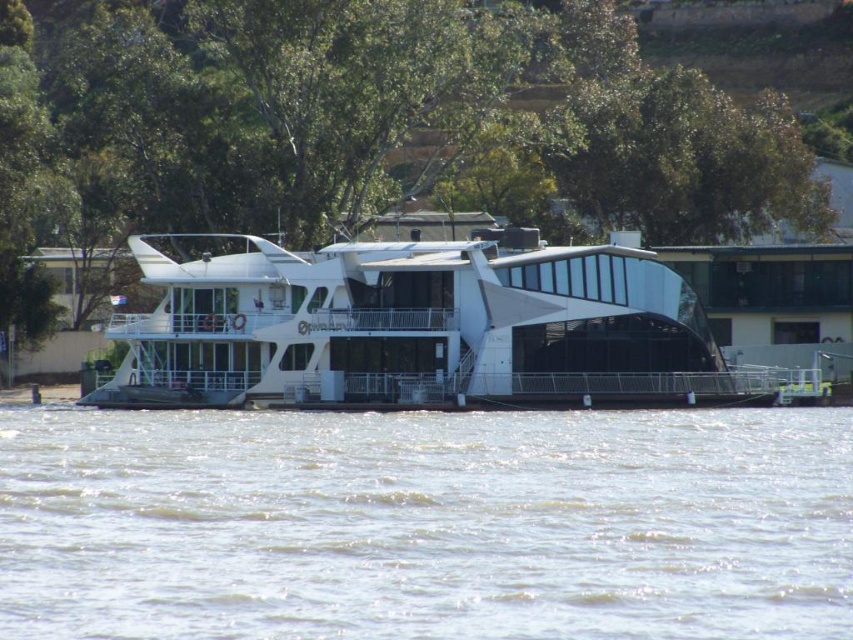
How much distance is there between clear water at lower center and white glossy boat at center?

clear water at lower center and white glossy boat at center are 10.90 meters apart from each other.

Looking at this image, between clear water at lower center and white glossy boat at center, which one appears on the left side from the viewer's perspective?

From the viewer's perspective, white glossy boat at center appears more on the left side.

What do you see at coordinates (425, 524) in the screenshot?
I see `clear water at lower center` at bounding box center [425, 524].

At what (x,y) coordinates should I click in order to perform the action: click on clear water at lower center. Please return your answer as a coordinate pair (x, y). The height and width of the screenshot is (640, 853). Looking at the image, I should click on [x=425, y=524].